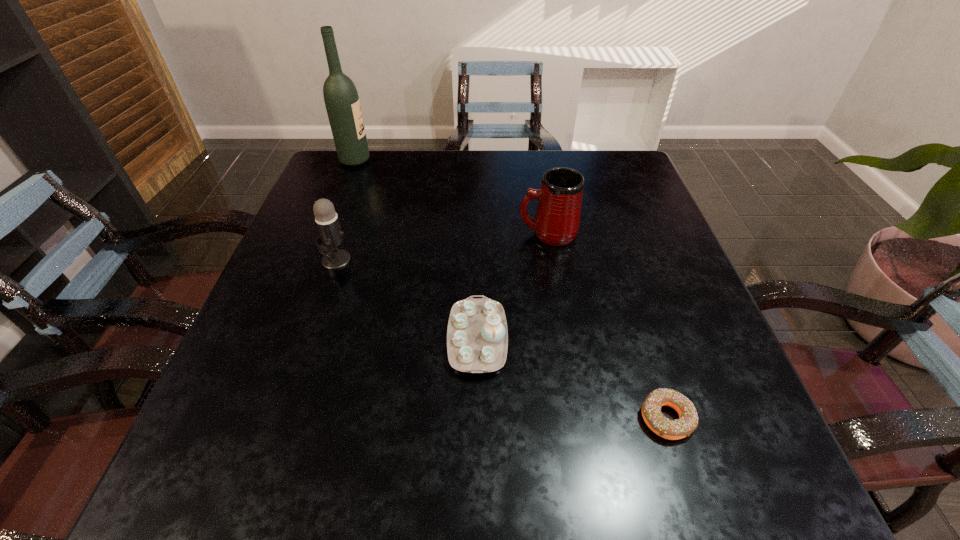
The image size is (960, 540). Find the location of `free spot that satisfies the following two spatial constraints: 1. on the front side of the doughnut; 2. on the left side of the microphone`. free spot that satisfies the following two spatial constraints: 1. on the front side of the doughnut; 2. on the left side of the microphone is located at coordinates (282, 417).

Locate an element on the screen. This screenshot has width=960, height=540. vacant position in the image that satisfies the following two spatial constraints: 1. on the front side of the doughnut; 2. on the right side of the chinaware is located at coordinates point(477,417).

At what (x,y) coordinates should I click in order to perform the action: click on vacant space that satisfies the following two spatial constraints: 1. on the side of the rightmost object with the handle; 2. on the left side of the mug. Please return your answer as a coordinate pair (x, y). Looking at the image, I should click on (579, 417).

Identify the location of free space that satisfies the following two spatial constraints: 1. on the front side of the third farthest object; 2. on the left side of the shortest object. (282, 417).

This screenshot has height=540, width=960. I want to click on free space in the image that satisfies the following two spatial constraints: 1. on the labeled side of the third farthest object; 2. on the left side of the farthest object, so click(x=317, y=260).

Find the location of a particular element. This screenshot has width=960, height=540. vacant space that satisfies the following two spatial constraints: 1. on the labeled side of the wine bottle; 2. on the left side of the chinaware is located at coordinates (286, 339).

This screenshot has height=540, width=960. I want to click on vacant region that satisfies the following two spatial constraints: 1. on the labeled side of the wine bottle; 2. on the back side of the third farthest object, so click(x=317, y=260).